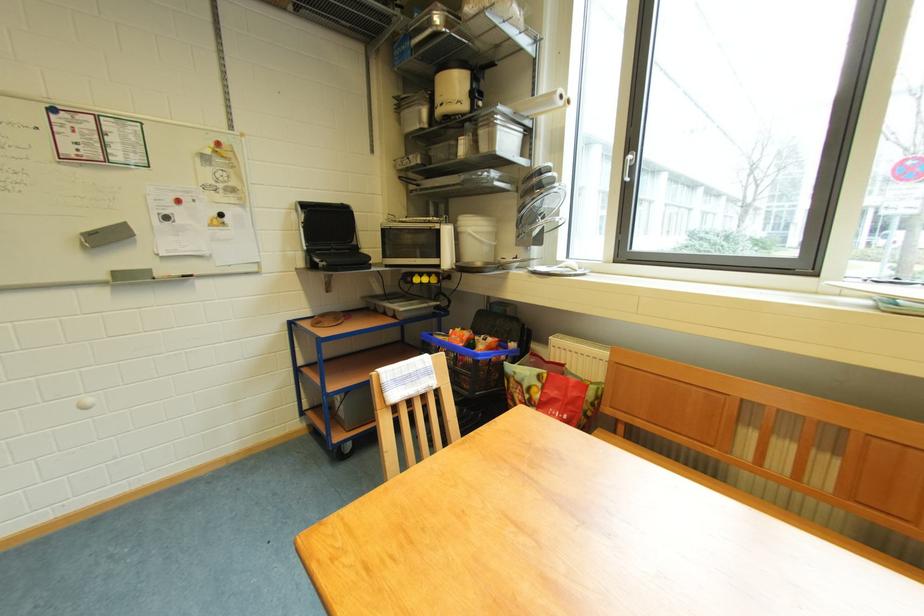
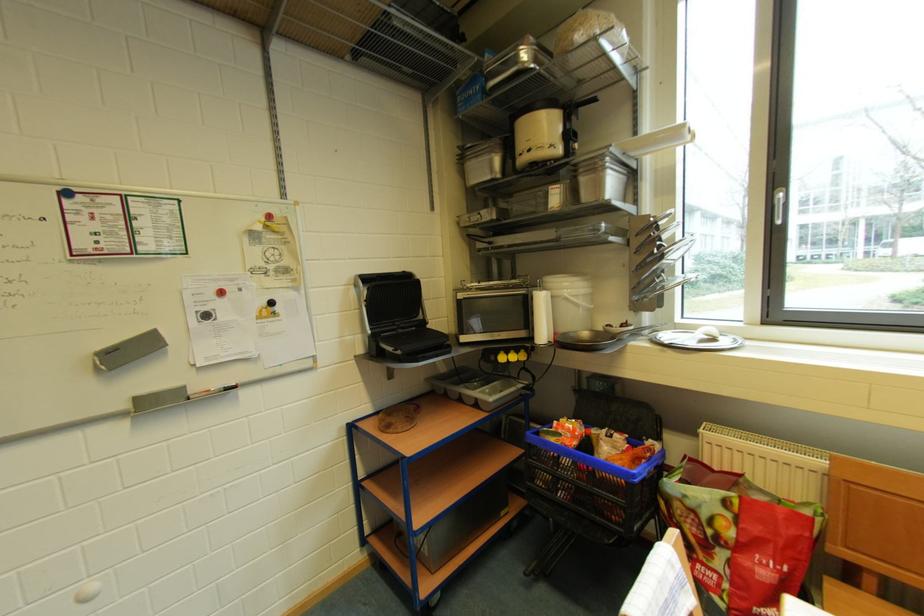
The point at (520, 262) is marked in the first image. Where is the corresponding point in the second image?

(629, 329)